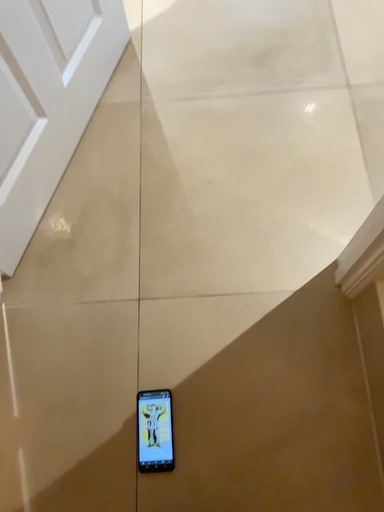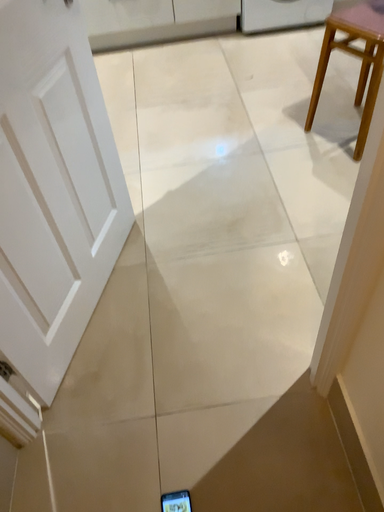
Question: Which way did the camera rotate in the video?

Choices:
 (A) rotated downward
 (B) rotated upward

Answer: (B)